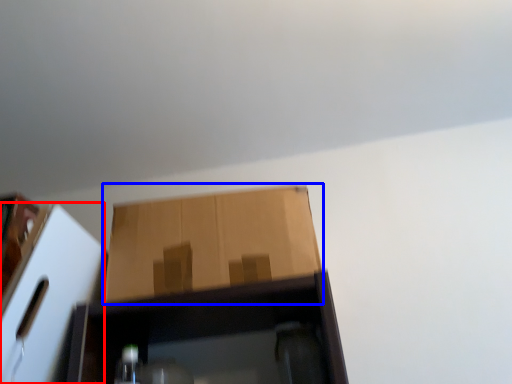
Question: Which point is further to the camera, cardboard box (highlighted by a red box) or cardboard box (highlighted by a blue box)?

Choices:
 (A) cardboard box
 (B) cardboard box

Answer: (B)